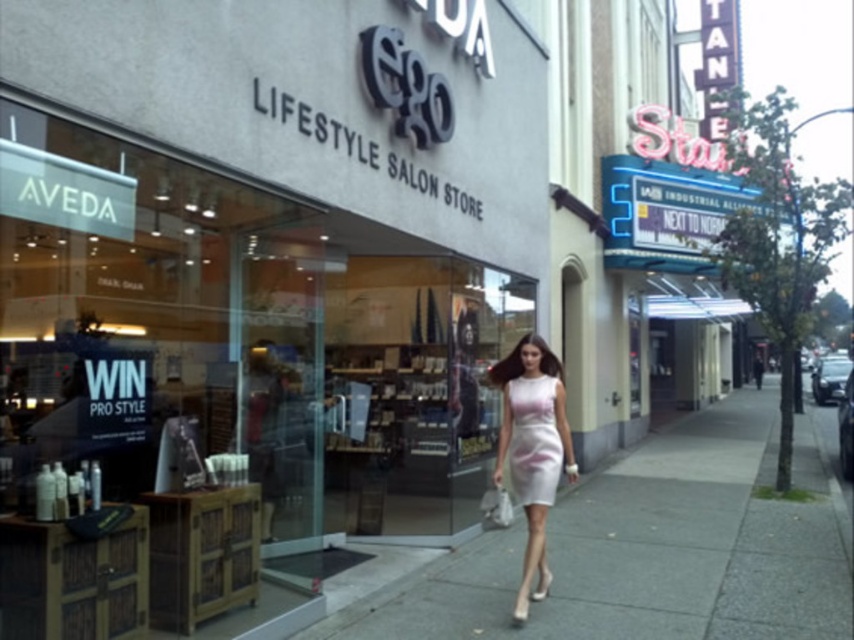
Based on the photo, you are standing at the entrance of the Ego Lifestyle Salon Store and want to walk to the Stain store. Which direction should you move relative to the white smooth pavement at center?

Since the Stain store is to the right of the Ego Lifestyle Salon Store, you should move towards the right side of the white smooth pavement at center to reach it.